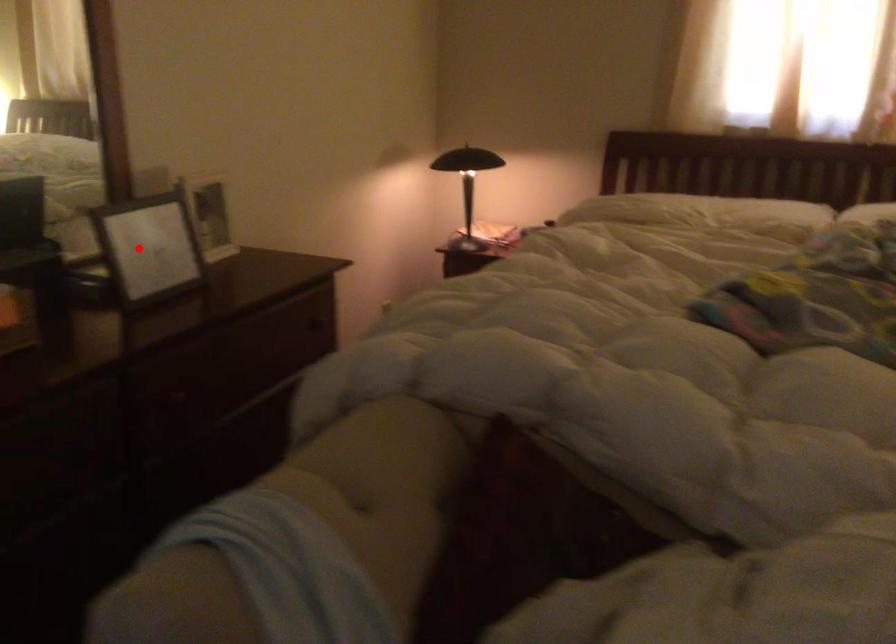
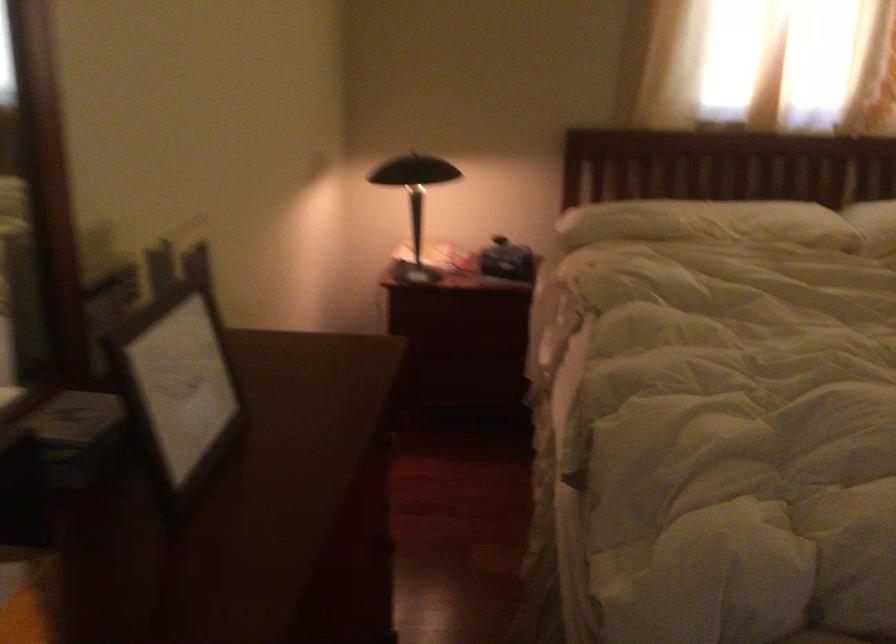
Question: I am providing you with two images of the same scene from different viewpoints. Image1 has a red point marked. In image2, the corresponding 3D location appears at what relative position? Reply with the corresponding letter.

Choices:
 (A) Closer
 (B) Farther

Answer: (A)